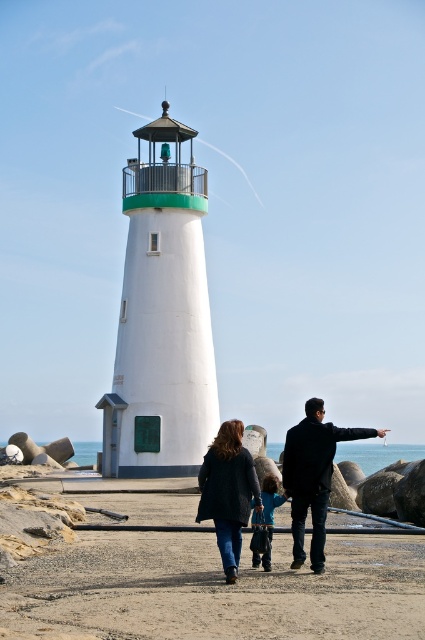
Question: Is black matte jacket at center to the left of blue fleece jacket at center from the viewer's perspective?

Choices:
 (A) yes
 (B) no

Answer: (B)

Question: Does smooth sand at lower center have a lesser width compared to blue fleece jacket at center?

Choices:
 (A) no
 (B) yes

Answer: (A)

Question: Can you confirm if black matte jacket at center is bigger than dark blue coat at center?

Choices:
 (A) no
 (B) yes

Answer: (A)

Question: Which point is farther to the camera?

Choices:
 (A) (268, 560)
 (B) (297, 557)
 (C) (241, 488)
 (D) (295, 628)

Answer: (B)

Question: Considering the real-world distances, which object is farthest from the blue fleece jacket at center?

Choices:
 (A) smooth sand at lower center
 (B) dark blue coat at center

Answer: (A)

Question: Which point is closer to the camera?

Choices:
 (A) (237, 451)
 (B) (363, 602)

Answer: (B)